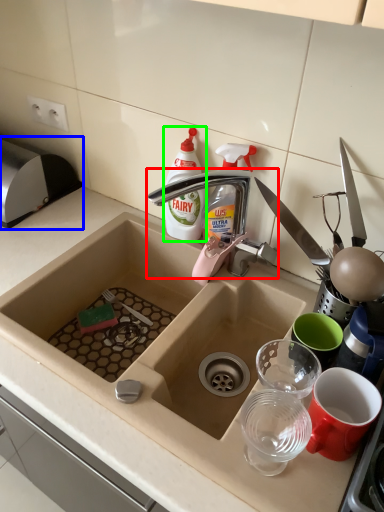
Question: Which is nearer to the tap (highlighted by a red box)? appliance (highlighted by a blue box) or bottle (highlighted by a green box).

Choices:
 (A) appliance
 (B) bottle

Answer: (B)